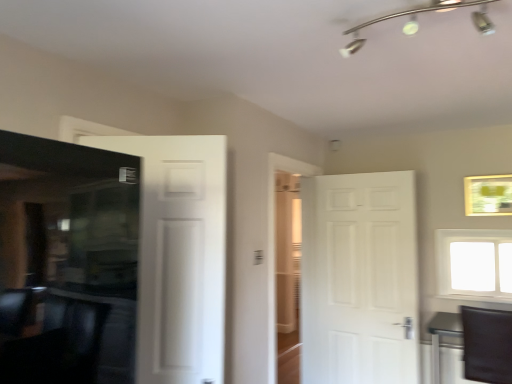
Question: Does white matte door at left, acting as the 1th door starting from the left, have a larger size compared to white matte door at right, arranged as the 1th door when viewed from the back?

Choices:
 (A) no
 (B) yes

Answer: (A)

Question: Is white matte door at left, acting as the 1th door starting from the left, not within white matte door at right, which ranks as the first door in right-to-left order?

Choices:
 (A) yes
 (B) no

Answer: (A)

Question: Is white matte door at left, acting as the 1th door starting from the left, behind white matte door at right, the 2th door from the front?

Choices:
 (A) no
 (B) yes

Answer: (A)

Question: Is white matte door at left, marked as the second door in a right-to-left arrangement, to the right of white matte door at right, which ranks as the first door in right-to-left order, from the viewer's perspective?

Choices:
 (A) no
 (B) yes

Answer: (A)

Question: Are white matte door at left, the 1th door positioned from the front, and white matte door at right, arranged as the 1th door when viewed from the back, making contact?

Choices:
 (A) no
 (B) yes

Answer: (A)

Question: From the image's perspective, is white matte door at left, marked as the second door in a right-to-left arrangement, below white matte door at right, arranged as the 1th door when viewed from the back?

Choices:
 (A) yes
 (B) no

Answer: (B)

Question: Does silver metallic track lighting at upper center appear on the left side of white matte door at left, acting as the second door starting from the back?

Choices:
 (A) no
 (B) yes

Answer: (A)

Question: Considering the relative sizes of silver metallic track lighting at upper center and white matte door at left, acting as the 1th door starting from the left, in the image provided, is silver metallic track lighting at upper center thinner than white matte door at left, acting as the 1th door starting from the left,?

Choices:
 (A) yes
 (B) no

Answer: (B)

Question: From the image's perspective, would you say silver metallic track lighting at upper center is positioned over white matte door at left, acting as the second door starting from the back?

Choices:
 (A) no
 (B) yes

Answer: (B)

Question: Is silver metallic track lighting at upper center far away from white matte door at left, marked as the second door in a right-to-left arrangement?

Choices:
 (A) yes
 (B) no

Answer: (A)

Question: Does silver metallic track lighting at upper center appear on the right side of white matte door at left, marked as the second door in a right-to-left arrangement?

Choices:
 (A) yes
 (B) no

Answer: (A)

Question: Is silver metallic track lighting at upper center positioned beyond the bounds of white matte door at left, acting as the second door starting from the back?

Choices:
 (A) no
 (B) yes

Answer: (B)

Question: Is white matte door at left, acting as the 1th door starting from the left, facing towards black leather swivel chair at lower right?

Choices:
 (A) no
 (B) yes

Answer: (A)